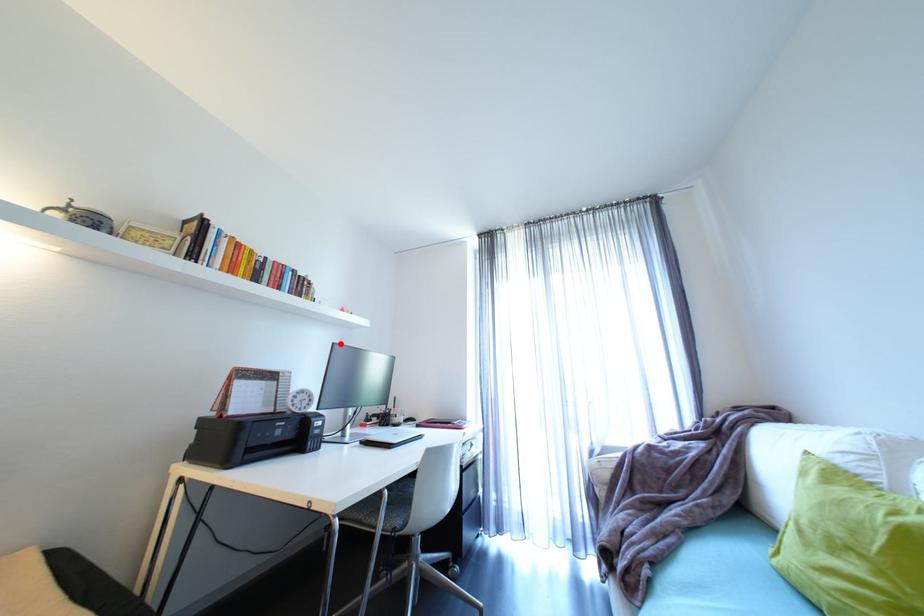
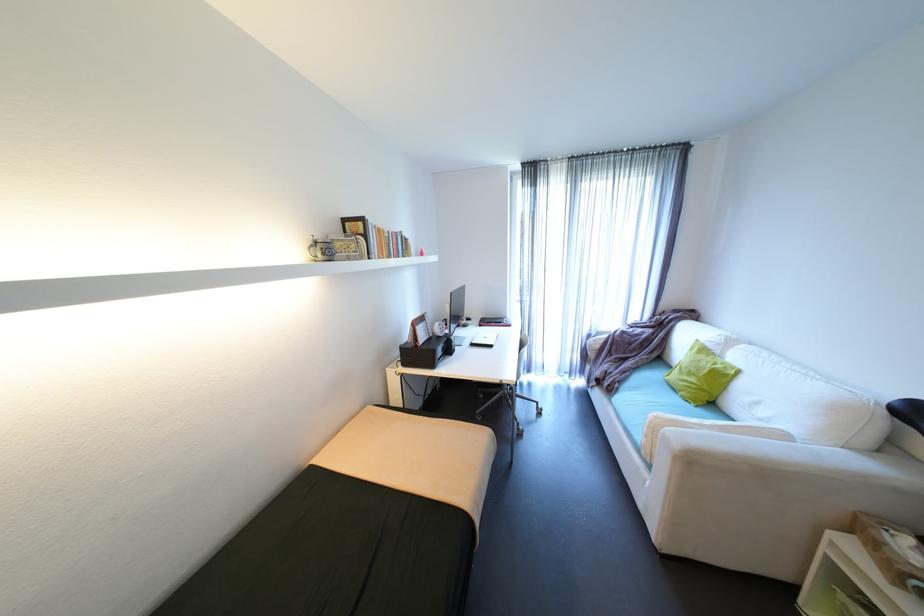
In the second image, find the point that corresponds to the highlighted location in the first image.

(458, 294)